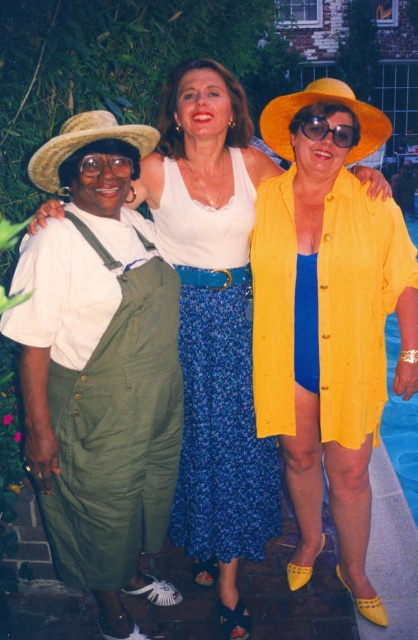
Question: Which object appears farthest from the camera in this image?

Choices:
 (A) yellow straw hat at center
 (B) straw hat at left
 (C) blue floral fabric dress at center
 (D) yellow matte swimsuit at center

Answer: (C)

Question: Considering the relative positions of blue floral fabric dress at center and yellow straw hat at center in the image provided, where is blue floral fabric dress at center located with respect to yellow straw hat at center?

Choices:
 (A) below
 (B) above

Answer: (A)

Question: Does blue smooth water at lower right lie in front of matte yellow sunglasses at center?

Choices:
 (A) yes
 (B) no

Answer: (B)

Question: Which point appears farthest from the camera in this image?

Choices:
 (A) (331, 513)
 (B) (140, 128)
 (C) (328, 77)

Answer: (C)

Question: Is yellow matte swimsuit at center bigger than matte yellow sunglasses at center?

Choices:
 (A) yes
 (B) no

Answer: (A)

Question: Which point is closer to the camera?

Choices:
 (A) [293, 160]
 (B) [292, 381]
 (C) [410, 451]

Answer: (B)